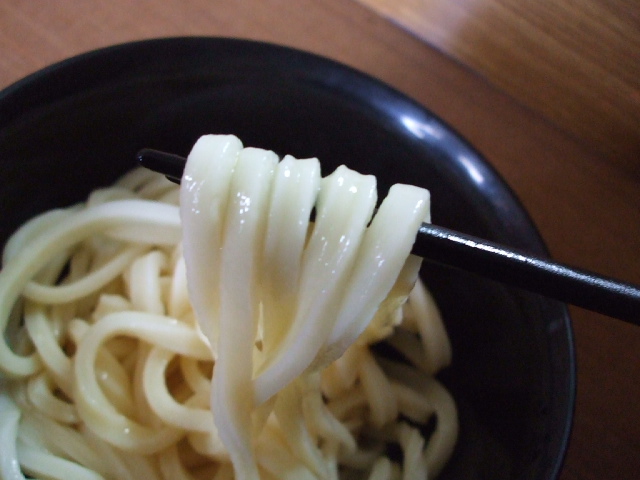
Identify the location of light glare. (467, 168), (418, 121), (244, 210), (192, 189).